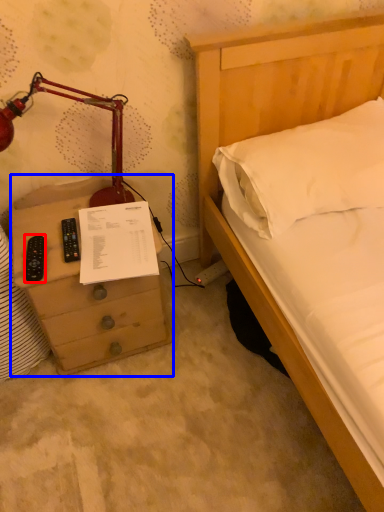
Question: Which of the following is the closest to the observer, remote (highlighted by a red box) or chest of drawers (highlighted by a blue box)?

Choices:
 (A) remote
 (B) chest of drawers

Answer: (B)